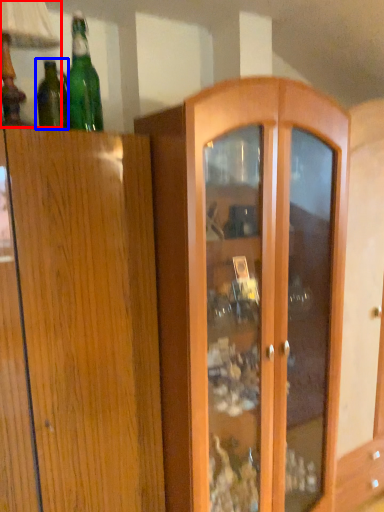
Question: Among these objects, which one is farthest to the camera, table lamp (highlighted by a red box) or bottle (highlighted by a blue box)?

Choices:
 (A) table lamp
 (B) bottle

Answer: (B)